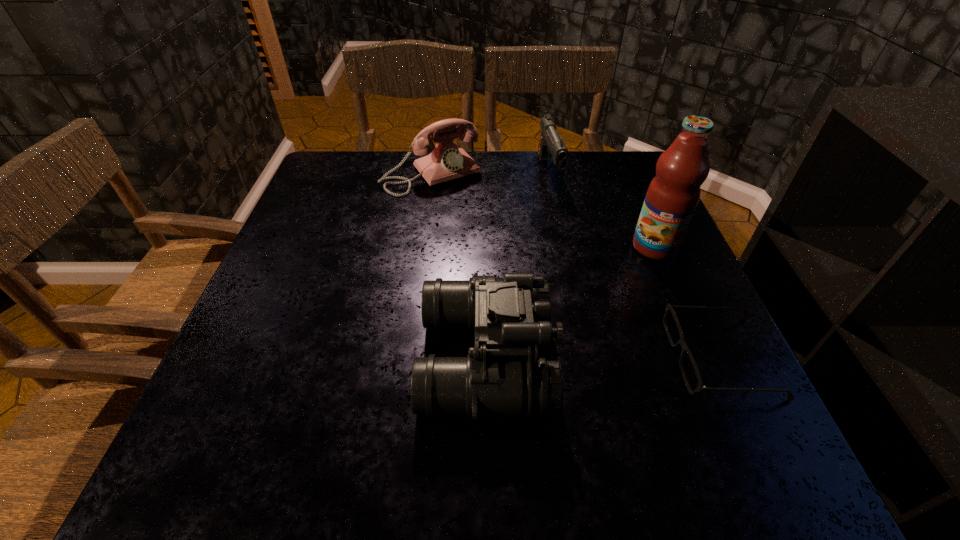
Identify the location of vacant space at the far left corner of the desktop. (382, 150).

In the image, there is a desktop. What are the coordinates of `vacant space at the far right corner` in the screenshot? It's located at (619, 180).

This screenshot has height=540, width=960. In order to click on free space at the near right corner in this screenshot , I will do `click(650, 373)`.

The image size is (960, 540). Identify the location of vacant area between the shortest object and the third nearest object. (687, 302).

Locate an element on the screen. This screenshot has height=540, width=960. empty space that is in between the binoculars and the telephone is located at coordinates (459, 266).

Identify the location of vacant space that's between the gun and the telephone. (491, 173).

I want to click on vacant space in between the shortest object and the telephone, so click(576, 266).

Image resolution: width=960 pixels, height=540 pixels. Find the location of `vacant area that lies between the shortest object and the binoculars`. vacant area that lies between the shortest object and the binoculars is located at coordinates (603, 357).

Locate an element on the screen. empty space that is in between the spectacles and the binoculars is located at coordinates (603, 357).

You are a GUI agent. You are given a task and a screenshot of the screen. Output one action in this format:
    pyautogui.click(x=<x>, y=<y>)
    Task: Click on the unoccupied position between the binoculars and the third farthest object
    This screenshot has height=540, width=960.
    Given the screenshot: What is the action you would take?
    pyautogui.click(x=570, y=302)